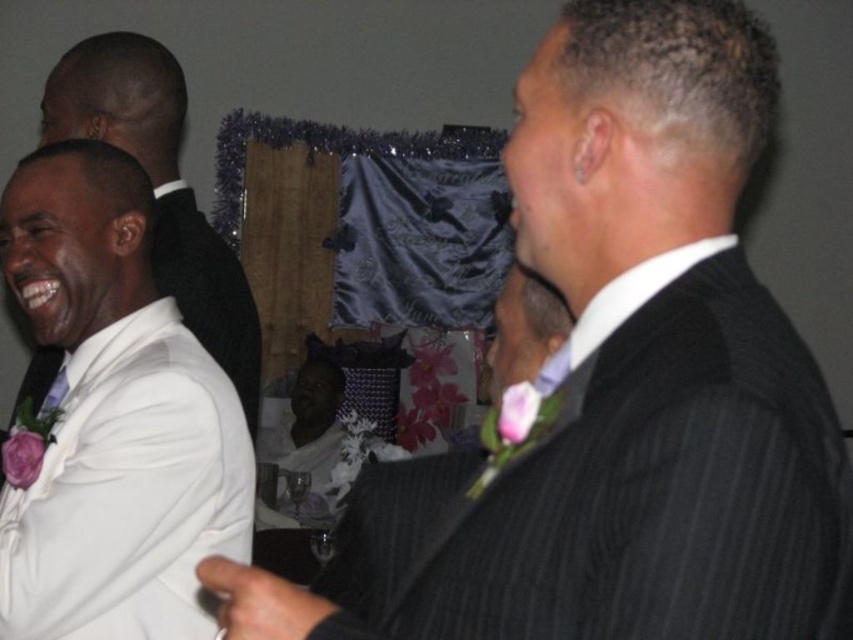
Between white satin shirt at left and white satin suit at left, which one has more height?

With more height is white satin suit at left.

Image resolution: width=853 pixels, height=640 pixels. Find the location of `white satin shirt at left`. white satin shirt at left is located at coordinates (114, 419).

Locate an element on the screen. This screenshot has width=853, height=640. white satin shirt at left is located at coordinates (114, 419).

Between matte black suit at center and matte white tie at left, which one appears on the right side from the viewer's perspective?

Positioned to the right is matte black suit at center.

The image size is (853, 640). In order to click on matte black suit at center in this screenshot , I will do `click(316, 449)`.

This screenshot has width=853, height=640. I want to click on matte black suit at center, so click(316, 449).

Locate an element on the screen. matte black suit at center is located at coordinates (316, 449).

Between point (210, 339) and point (322, 381), which one is positioned in front?

Point (210, 339) is in front.

Which of these two, white satin suit at left or matte black suit at center, stands taller?

With more height is white satin suit at left.

Between point (173, 120) and point (345, 436), which one is positioned in front?

Point (173, 120) is in front.

In order to click on white satin suit at left in this screenshot , I will do `click(160, 188)`.